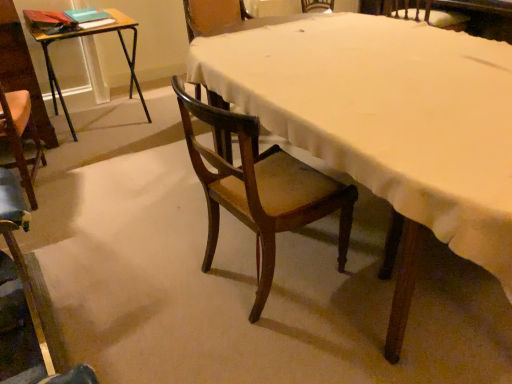
At what (x,y) coordinates should I click in order to perform the action: click on vacant area that is in front of wooden desk at left. Please return your answer as a coordinate pair (x, y). Looking at the image, I should click on (100, 159).